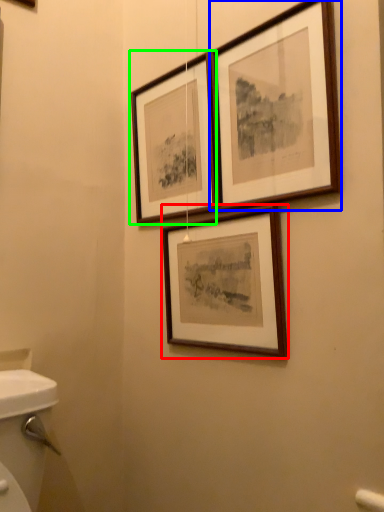
Question: Based on their relative distances, which object is nearer to picture frame (highlighted by a red box)? Choose from picture frame (highlighted by a blue box) and picture frame (highlighted by a green box).

Choices:
 (A) picture frame
 (B) picture frame

Answer: (A)